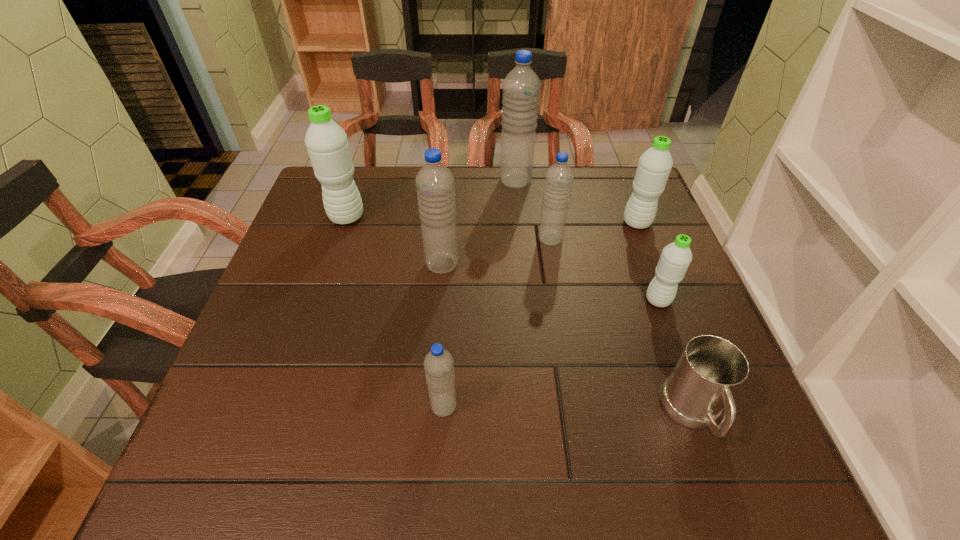
At what (x,y) coordinates should I click in order to perform the action: click on free area in between the tallest object and the smallest blue water bottle. Please return your answer as a coordinate pair (x, y). The width and height of the screenshot is (960, 540). Looking at the image, I should click on (480, 294).

This screenshot has width=960, height=540. Identify the location of object that ranks as the fourth closest to the leftmost object. point(438,363).

Find the location of a particular element. This screenshot has height=540, width=960. object identified as the fifth closest to the biggest blue water bottle is located at coordinates (676, 257).

Select which water bottle is the fourth closest to the biggest green water bottle. Please provide its 2D coordinates. Your answer should be formatted as a tuple, i.e. [(x, y)], where the tuple contains the x and y coordinates of a point satisfying the conditions above.

[(438, 363)]

Where is `water bottle identified as the closest to the biggest blue water bottle`? water bottle identified as the closest to the biggest blue water bottle is located at coordinates (559, 177).

You are a GUI agent. You are given a task and a screenshot of the screen. Output one action in this format:
    pyautogui.click(x=<x>, y=<y>)
    Task: Click on the blue water bottle object that ranks as the second closest to the second biggest green water bottle
    The width and height of the screenshot is (960, 540).
    Given the screenshot: What is the action you would take?
    pyautogui.click(x=521, y=87)

This screenshot has height=540, width=960. In order to click on blue water bottle object that ranks as the third closest to the shortest object in this screenshot , I will do `click(435, 183)`.

Choose which green water bottle is the nearest neighbor to the leftmost water bottle. Please provide its 2D coordinates. Your answer should be formatted as a tuple, i.e. [(x, y)], where the tuple contains the x and y coordinates of a point satisfying the conditions above.

[(654, 166)]

Identify the location of green water bottle that stands as the second closest to the second biggest green water bottle. pos(327,144).

The image size is (960, 540). In order to click on vacant space that satisfies the following two spatial constraints: 1. on the back side of the second biggest blue water bottle; 2. on the left side of the second smallest green water bottle in this screenshot , I will do [445, 222].